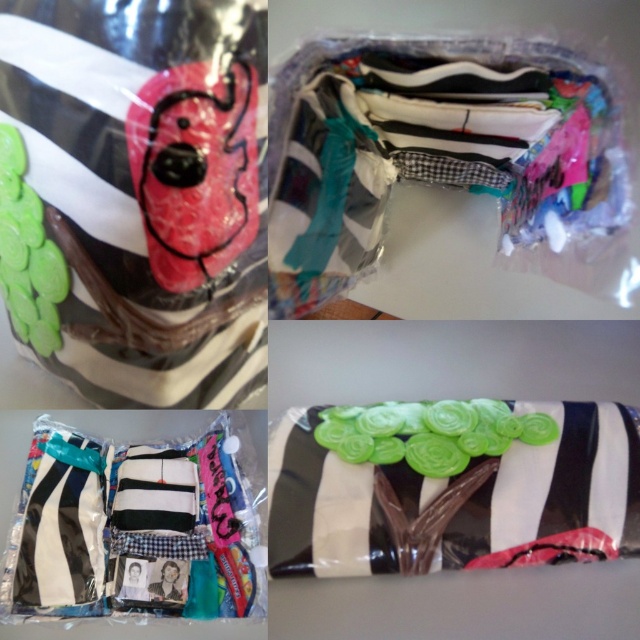
Consider the image. You are examining the interior of the item in the top right photograph. There are two points labeled as point 1 and point 2. Point 1 is located at coordinates (x=38, y=317) and point 2 is at (x=346, y=44). Which point is closer to you?

Point 1 at coordinates (x=38, y=317) is closer to you because it is further to the camera than point 2 at (x=346, y=44).

Looking at the top right section of the collage, which object is positioned lower between the matte plastic chocolate cake at upper left and the matte plastic bag at center?

The matte plastic chocolate cake at upper left is positioned lower than the matte plastic bag at center.